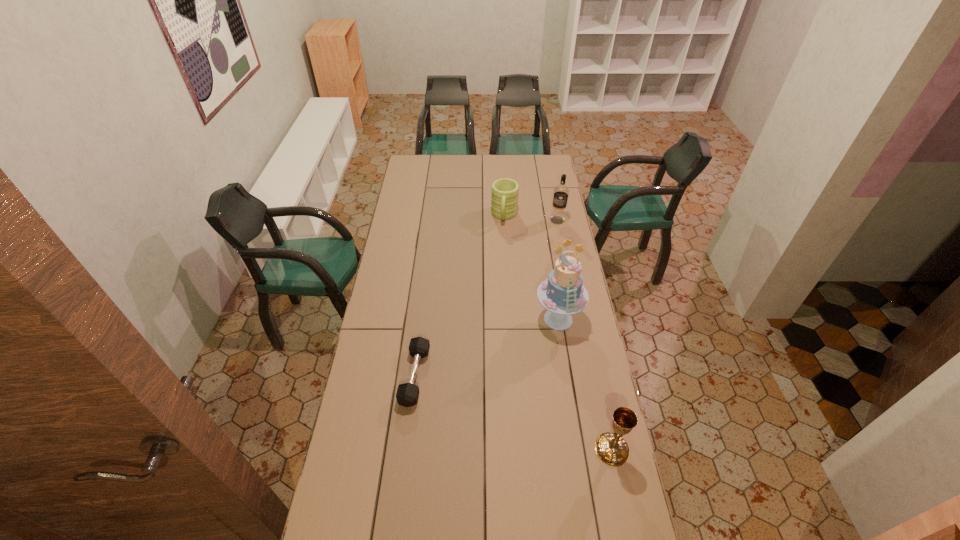
This screenshot has height=540, width=960. Identify the location of vacant point located between the cake and the fourth object from right to left. (531, 267).

You are a GUI agent. You are given a task and a screenshot of the screen. Output one action in this format:
    pyautogui.click(x=<x>, y=<y>)
    Task: Click on the empty space that is in between the dumbbell and the mug
    Image resolution: width=960 pixels, height=540 pixels.
    Given the screenshot: What is the action you would take?
    pyautogui.click(x=460, y=296)

Find the location of a particular element. vacant space that's between the fourth farthest object and the chalice is located at coordinates (514, 413).

Locate an element on the screen. free point between the dumbbell and the third farthest object is located at coordinates (487, 347).

Identify the location of empty space that is in between the fourth object from right to left and the third shortest object. The width and height of the screenshot is (960, 540). (558, 333).

Where is `free area in between the leftmost object and the mug`? free area in between the leftmost object and the mug is located at coordinates (460, 296).

Find the location of a particular element. The width and height of the screenshot is (960, 540). object identified as the fourth closest to the dumbbell is located at coordinates (561, 192).

Find the location of a particular element. This screenshot has width=960, height=540. object that is the third nearest to the dumbbell is located at coordinates [x=504, y=196].

I want to click on free space that satisfies the following two spatial constraints: 1. on the back side of the fourth shortest object; 2. on the left side of the dumbbell, so click(434, 220).